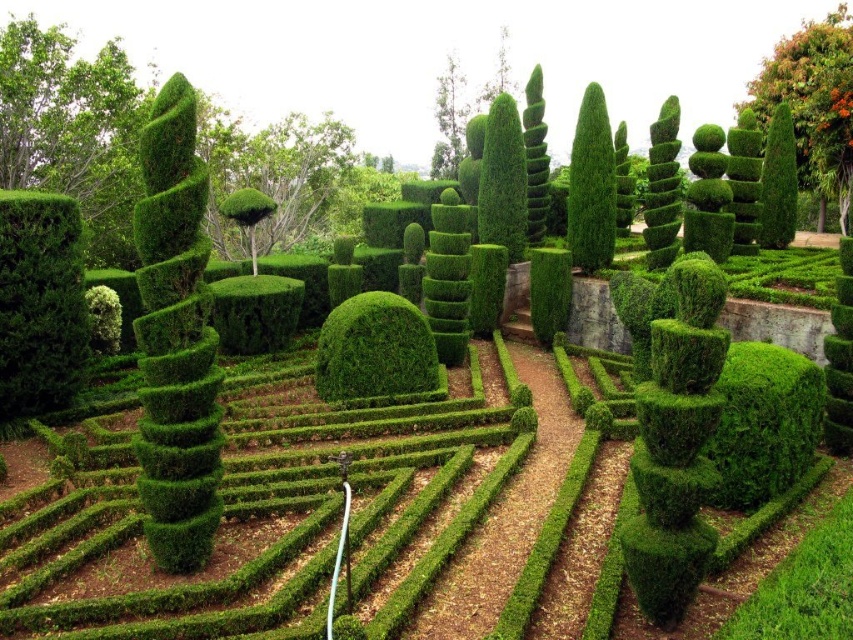
You are a gardener who needs to water the green leafy bush at center and the green textured bush at center. Since you can only water one at a time, which one should you water first if you want to reach the one behind it afterward?

You should water the green leafy bush at center first because it is in front of the green textured bush at center, so after watering the one in front, you can easily access the one behind it.

You are a gardener planning to place a 1.2 meter wide decorative statue between the green textured bush at left and the green leafy bush at upper right. Based on their widths, will the statue fit between them?

The green textured bush at left has a lesser width compared to green leafy bush at upper right. Since the statue is 1.2 meters wide, it depends on the actual widths of the bushes. However, since the green textured bush is narrower, the total available space between them might be sufficient. Without exact measurements, it is uncertain, but the statue could potentially fit if the combined width of both bushes allows for it.

You are a gardener planning to water the green textured bush at left and the green leafy bush at upper right. Since you can only water one at a time, which bush should you water first if you want to avoid getting the other one wet?

You should water the green textured bush at left first because it is in front of the green leafy bush at upper right. If you water the one behind first, water might splash onto the front one, so watering the front one first ensures the one behind stays dry.